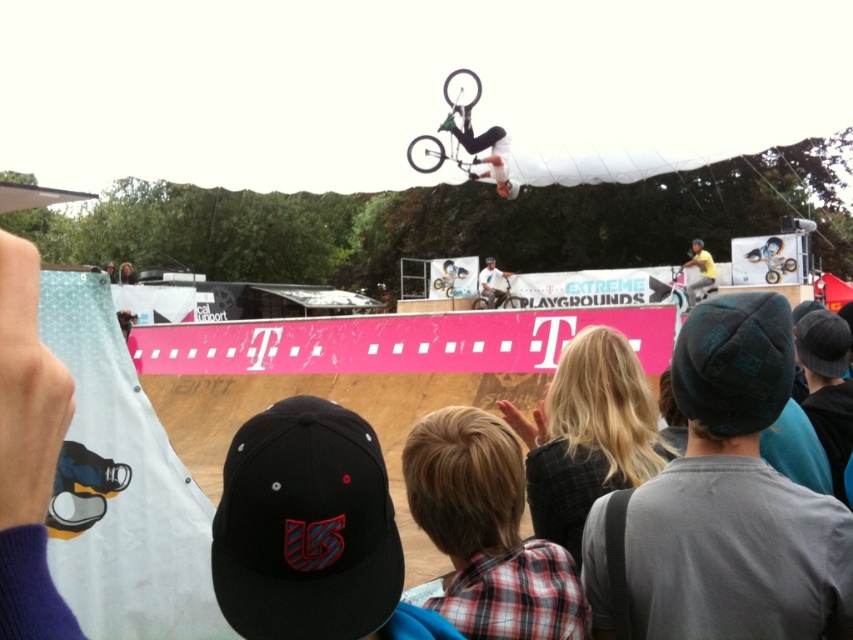
Is plaid fabric shirt at center taller than matte black dirt bike at center?

Incorrect, plaid fabric shirt at center's height is not larger of matte black dirt bike at center's.

Where is `plaid fabric shirt at center`? The image size is (853, 640). plaid fabric shirt at center is located at coordinates (486, 531).

Between plaid fabric shirt at center and light blue denim jeans at center, which one appears on the right side from the viewer's perspective?

light blue denim jeans at center

Who is more forward, (416, 428) or (506, 273)?

Point (416, 428)

Is point (468, 410) positioned in front of point (485, 285)?

Yes.

What are the coordinates of `plaid fabric shirt at center` in the screenshot? It's located at (486, 531).

Who is shorter, yellow matte shirt at upper center or light brown leather jacket at upper center?

With less height is light brown leather jacket at upper center.

Between yellow matte shirt at upper center and light brown leather jacket at upper center, which one appears on the left side from the viewer's perspective?

light brown leather jacket at upper center is more to the left.

Is point (697, 278) less distant than point (128, 260)?

Yes, point (697, 278) is in front of point (128, 260).

This screenshot has width=853, height=640. In order to click on yellow matte shirt at upper center in this screenshot , I will do `click(698, 269)`.